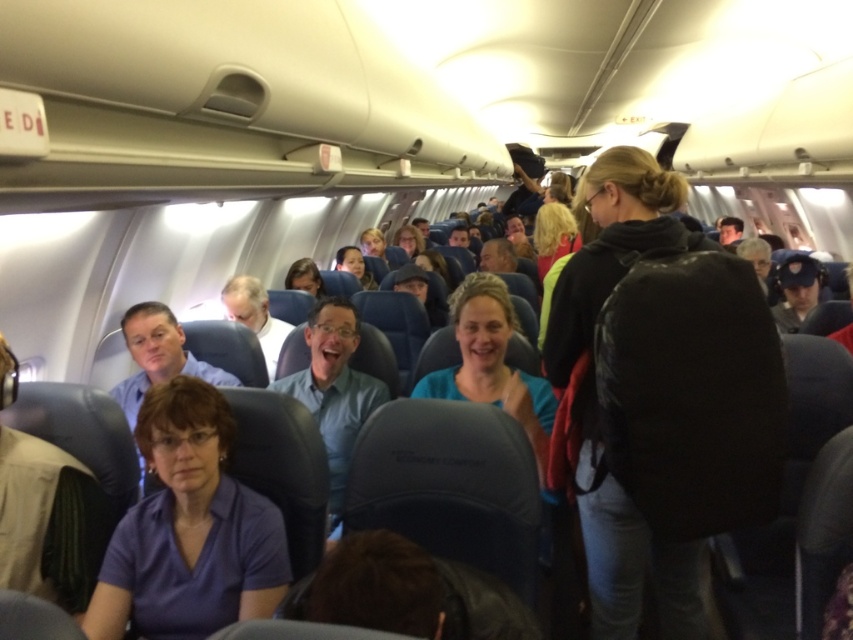
You are a flight attendant who needs to hand out emergency instructions to all passengers. You see a passenger wearing a black leather jacket at upper right and another wearing a light blue shirt at center. Which passenger should you approach first if you want to give instructions to the larger clothing item?

The black leather jacket at upper right is larger in size than the light blue shirt at center, so you should approach the passenger wearing the black leather jacket at upper right first.

You are a flight attendant carrying a 1.05 meter wide food tray. You need to walk from the galley to the back of the cabin, passing between the black leather jacket at upper right and the light blue shirt at center. Will your tray fit through the space between them?

The distance between the black leather jacket at upper right and the light blue shirt at center is 1.10 meters. Since the food tray is 1.05 meters wide, it will fit through the space between them with a small gap of 0.05 meters remaining.